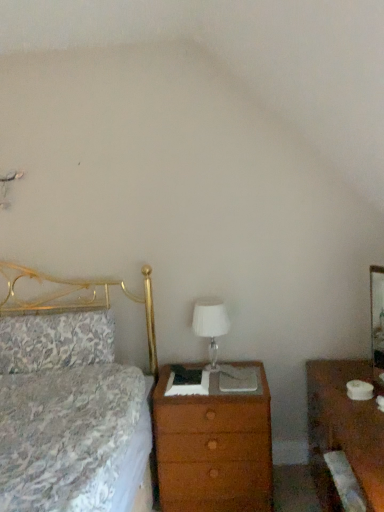
Question: From a real-world perspective, relative to wooden chest of drawers at center, is brown wood nightstand at right vertically above or below?

Choices:
 (A) below
 (B) above

Answer: (B)

Question: Considering the positions of brown wood nightstand at right and wooden chest of drawers at center in the image, is brown wood nightstand at right bigger or smaller than wooden chest of drawers at center?

Choices:
 (A) small
 (B) big

Answer: (B)

Question: Which object is the farthest from the wooden chest of drawers at center?

Choices:
 (A) white glass table lamp at center
 (B) floral fabric pillow at left
 (C) brown wood nightstand at right

Answer: (B)

Question: Which of these objects is positioned farthest from the floral fabric pillow at left?

Choices:
 (A) wooden chest of drawers at center
 (B) white glass table lamp at center
 (C) brown wood nightstand at right

Answer: (C)